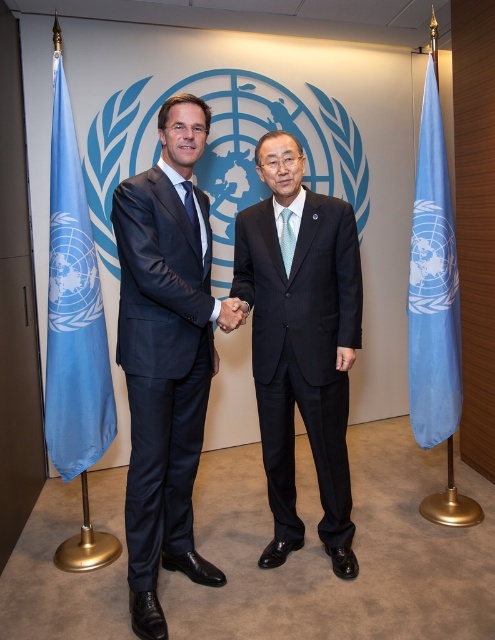
Who is higher up, blue fabric flag at right or light blue silk tie at center?

light blue silk tie at center

Where is `blue fabric flag at right`? This screenshot has height=640, width=495. blue fabric flag at right is located at coordinates (433, 285).

The width and height of the screenshot is (495, 640). I want to click on blue fabric flag at right, so point(433,285).

Based on the photo, is light blue silk tie at center smaller than blue silk tie at center?

Yes, light blue silk tie at center is smaller than blue silk tie at center.

Which is below, light blue silk tie at center or blue silk tie at center?

light blue silk tie at center is below.

Identify the location of light blue silk tie at center. Image resolution: width=495 pixels, height=640 pixels. (287, 237).

Does dark blue pinstripe suit at center appear under blue fabric flag at left?

Yes.

The width and height of the screenshot is (495, 640). What do you see at coordinates (300, 342) in the screenshot? I see `dark blue pinstripe suit at center` at bounding box center [300, 342].

Identify the location of dark blue pinstripe suit at center. This screenshot has width=495, height=640. (300, 342).